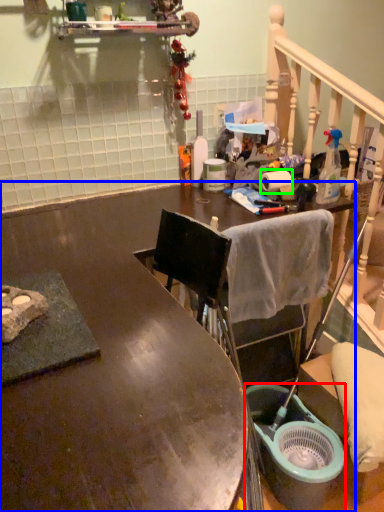
Question: Considering the real-world distances, which object is closest to bucket (highlighted by a red box)? desk (highlighted by a blue box) or toilet paper (highlighted by a green box).

Choices:
 (A) desk
 (B) toilet paper

Answer: (A)